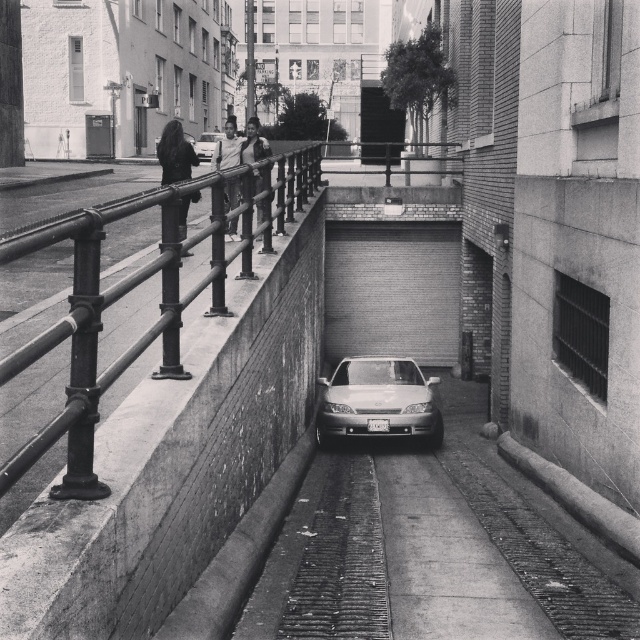
In the scene shown: You are a delivery person carrying a package that requires a clear path 3 meters wide to maneuver. You are currently standing in the alleyway shown in the image. Can you safely navigate past the black metal railing at upper left without obstructing your path?

The distance between you and the black metal railing at upper left is 2.54 meters, which is less than the required 3 meters for your package. Therefore, you cannot safely navigate past the black metal railing at upper left without obstructing your path.

You are standing in the alleyway and want to walk from the metal railing on the left to the garage on the right. There are two points marked on the ground as reference points. The first point is at coordinate point (342, 356) and the second point is at point (200, 136). Which point should you step on first to ensure you are moving towards the garage?

You should step on point (342, 356) first because it is in front of point (200, 136), meaning it is closer to the garage direction.

You are a delivery person trying to navigate through the alley. The alley is only wide enough for one vehicle at a time. There is a black metal railing at upper left and a shiny silver sedan at center. Which object is closer to the entrance of the alley?

The shiny silver sedan at center is closer to the entrance of the alley because the black metal railing at upper left is to the right of it, meaning the sedan is positioned further towards the entrance.